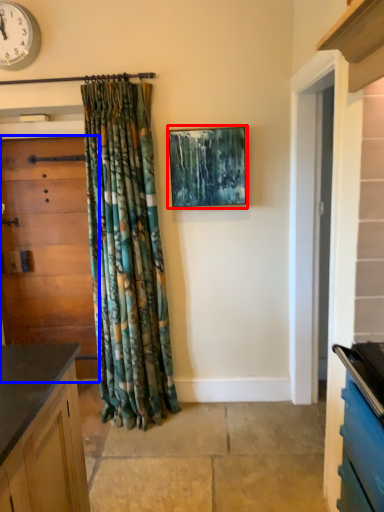
Question: Among these objects, which one is farthest to the camera, picture frame (highlighted by a red box) or door (highlighted by a blue box)?

Choices:
 (A) picture frame
 (B) door

Answer: (B)